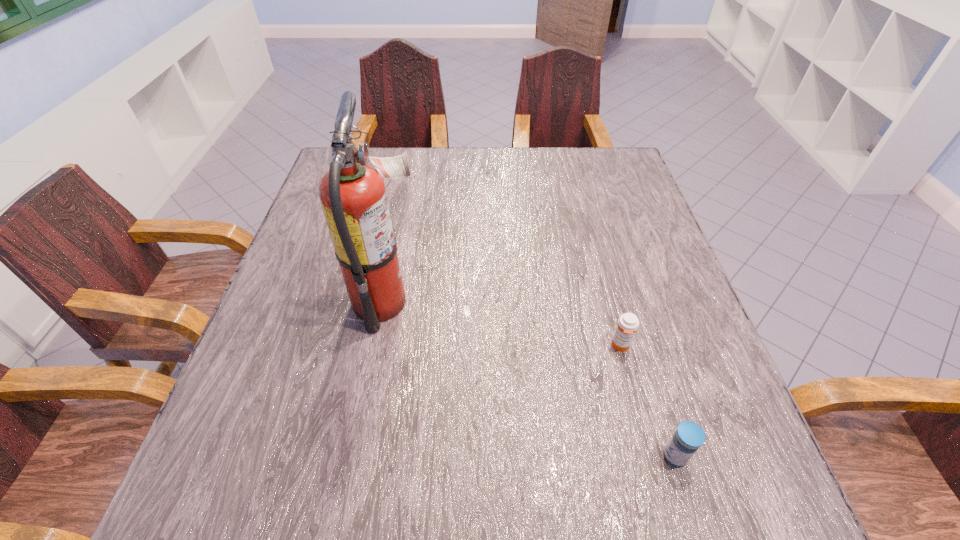
Find the location of a particular element. the tallest object is located at coordinates (353, 196).

Where is `fire extinguisher`? The width and height of the screenshot is (960, 540). fire extinguisher is located at coordinates (353, 196).

Where is `the farther medicine`? This screenshot has height=540, width=960. the farther medicine is located at coordinates click(628, 323).

Where is `the second object from left to right`? This screenshot has height=540, width=960. the second object from left to right is located at coordinates click(628, 323).

I want to click on the nearer medicine, so click(689, 436).

The width and height of the screenshot is (960, 540). Find the location of `the rightmost object`. the rightmost object is located at coordinates (689, 436).

The image size is (960, 540). Identify the location of vacant space located 0.210m from the nozzle of the fire extinguisher. (520, 302).

Identify the location of vacant space located 0.340m on the back of the second object from right to left. This screenshot has height=540, width=960. (589, 229).

Find the location of a particular element. free space located 0.240m on the left of the nearest object is located at coordinates (516, 456).

This screenshot has width=960, height=540. I want to click on object at the near edge, so click(x=689, y=436).